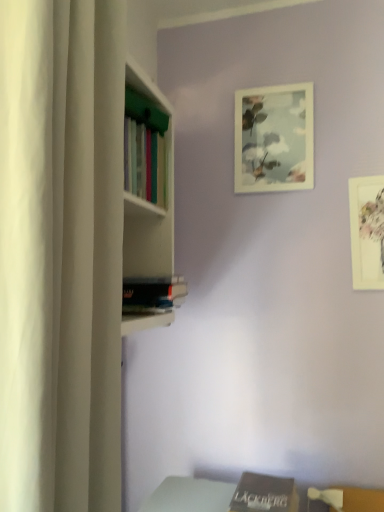
What do you see at coordinates (264, 494) in the screenshot? I see `brown matte book at lower center, positioned as the second book in left-to-right order` at bounding box center [264, 494].

Locate an element on the screen. Image resolution: width=384 pixels, height=512 pixels. hardcover book at center, the 2th book from the bottom is located at coordinates (153, 294).

Find the location of a particular element. Image resolution: width=384 pixels, height=512 pixels. white matte picture frame at upper right, the 1th picture frame when ordered from right to left is located at coordinates (367, 232).

From a real-world perspective, is white matte picture frame at upper right, marked as the second picture frame in a left-to-right arrangement, under white matte curtain at left?

No.

Is white matte curtain at left surrounded by white matte picture frame at upper right, the 2th picture frame when ordered from top to bottom?

Actually, white matte curtain at left is outside white matte picture frame at upper right, the 2th picture frame when ordered from top to bottom.

Does point (370, 217) appear closer or farther from the camera than point (2, 495)?

Clearly, point (370, 217) is more distant from the camera than point (2, 495).

From a real-world perspective, which object stands above the other?

From a 3D spatial view, matte white picture frame at upper center, the 1th picture frame positioned from the left, is above.

Are matte white picture frame at upper center, marked as the 2th picture frame in a bottom-to-top arrangement, and white matte picture frame at upper right, the 1th picture frame in the front-to-back sequence, far apart?

No, there isn't a large distance between matte white picture frame at upper center, marked as the 2th picture frame in a bottom-to-top arrangement, and white matte picture frame at upper right, the 1th picture frame in the front-to-back sequence.

Considering the relative positions of matte white picture frame at upper center, positioned as the second picture frame in right-to-left order, and white matte picture frame at upper right, the 2th picture frame when ordered from top to bottom, in the image provided, is matte white picture frame at upper center, positioned as the second picture frame in right-to-left order, to the right of white matte picture frame at upper right, the 2th picture frame when ordered from top to bottom, from the viewer's perspective?

Incorrect, matte white picture frame at upper center, positioned as the second picture frame in right-to-left order, is not on the right side of white matte picture frame at upper right, the 2th picture frame when ordered from top to bottom.

How many degrees apart are the facing directions of matte white picture frame at upper center, positioned as the second picture frame in right-to-left order, and white matte picture frame at upper right, the 1th picture frame when ordered from right to left?

The facing directions of matte white picture frame at upper center, positioned as the second picture frame in right-to-left order, and white matte picture frame at upper right, the 1th picture frame when ordered from right to left, are 0.00377 degrees apart.

From a real-world perspective, is white matte picture frame at upper right, marked as the second picture frame in a left-to-right arrangement, beneath brown matte book at lower center, positioned as the second book in left-to-right order?

No.

Is white matte picture frame at upper right, the 2th picture frame when ordered from top to bottom, not within brown matte book at lower center, the 1th book from the right?

Yes, white matte picture frame at upper right, the 2th picture frame when ordered from top to bottom, is not within brown matte book at lower center, the 1th book from the right.

Is white matte picture frame at upper right, the 1th picture frame when ordered from right to left, thinner than brown matte book at lower center, positioned as the second book in left-to-right order?

Correct, the width of white matte picture frame at upper right, the 1th picture frame when ordered from right to left, is less than that of brown matte book at lower center, positioned as the second book in left-to-right order.

Is there a large distance between white matte picture frame at upper right, the 1th picture frame when ordered from right to left, and brown matte book at lower center, the first book when ordered from bottom to top?

That's not correct — white matte picture frame at upper right, the 1th picture frame when ordered from right to left, is a little close to brown matte book at lower center, the first book when ordered from bottom to top.

Who is more distant, brown matte book at lower center, the first book when ordered from bottom to top, or hardcover book at center, the first book from the top?

Positioned behind is hardcover book at center, the first book from the top.

Which of these two, brown matte book at lower center, positioned as the second book in left-to-right order, or hardcover book at center, the 2th book from the bottom, is smaller?

brown matte book at lower center, positioned as the second book in left-to-right order.

Does brown matte book at lower center, which is the second book from top to bottom, have a greater height compared to hardcover book at center, the 2th book from the bottom?

No.

From a real-world perspective, is hardcover book at center, the 1th book from the left, located higher than white matte curtain at left?

No, from a real-world perspective, hardcover book at center, the 1th book from the left, is not over white matte curtain at left

Is hardcover book at center, the second book positioned from the right, oriented away from white matte curtain at left?

No.

Is hardcover book at center, the 1th book from the left, inside or outside of white matte curtain at left?

hardcover book at center, the 1th book from the left, is outside white matte curtain at left.

From the image's perspective, is hardcover book at center, the 1th book from the left, above or below white matte curtain at left?

Clearly, from the image's perspective, hardcover book at center, the 1th book from the left, is below white matte curtain at left.

How different are the orientations of brown matte book at lower center, positioned as the second book in left-to-right order, and white matte picture frame at upper right, the 1th picture frame when ordered from right to left, in degrees?

They differ by 0.254 degrees in their facing directions.

From a real-world perspective, relative to white matte picture frame at upper right, the 1th picture frame ordered from the bottom, is brown matte book at lower center, the 1th book from the right, vertically above or below?

Clearly, from a real-world perspective, brown matte book at lower center, the 1th book from the right, is below white matte picture frame at upper right, the 1th picture frame ordered from the bottom.

Is brown matte book at lower center, the 1th book from the right, surrounding white matte picture frame at upper right, the 1th picture frame ordered from the bottom?

No, white matte picture frame at upper right, the 1th picture frame ordered from the bottom, is located outside of brown matte book at lower center, the 1th book from the right.

Is white matte curtain at left at the right side of white matte picture frame at upper right, marked as the second picture frame in a left-to-right arrangement?

No.

From the image's perspective, which one is positioned lower, white matte curtain at left or white matte picture frame at upper right, marked as the second picture frame in a left-to-right arrangement?

white matte curtain at left.

From a real-world perspective, is white matte curtain at left beneath white matte picture frame at upper right, marked as the second picture frame in a left-to-right arrangement?

Yes.

Is white matte curtain at left bigger than white matte picture frame at upper right, which is counted as the second picture frame, starting from the back?

Indeed, white matte curtain at left has a larger size compared to white matte picture frame at upper right, which is counted as the second picture frame, starting from the back.

You are a GUI agent. You are given a task and a screenshot of the screen. Output one action in this format:
    pyautogui.click(x=<x>, y=<y>)
    Task: Click on the curtain below the white matte picture frame at upper right, the 1th picture frame in the front-to-back sequence (from the image's perspective)
    This screenshot has height=512, width=384.
    Given the screenshot: What is the action you would take?
    pyautogui.click(x=61, y=253)

You are a GUI agent. You are given a task and a screenshot of the screen. Output one action in this format:
    pyautogui.click(x=<x>, y=<y>)
    Task: Click on the picture frame that appears on the left of white matte picture frame at upper right, the 1th picture frame in the front-to-back sequence
    This screenshot has height=512, width=384.
    Given the screenshot: What is the action you would take?
    pyautogui.click(x=274, y=139)

Which object lies nearer to the anchor point hardcover book at center, the 2th book from the bottom, brown matte book at lower center, positioned as the second book in left-to-right order, or white matte picture frame at upper right, the 2th picture frame when ordered from top to bottom?

brown matte book at lower center, positioned as the second book in left-to-right order, lies closer to hardcover book at center, the 2th book from the bottom, than the other object.

Looking at the image, which one is located closer to white matte picture frame at upper right, the 1th picture frame in the front-to-back sequence, white matte curtain at left or hardcover book at center, the second book positioned from the right?

hardcover book at center, the second book positioned from the right, lies closer to white matte picture frame at upper right, the 1th picture frame in the front-to-back sequence, than the other object.

Estimate the real-world distances between objects in this image. Which object is closer to white matte picture frame at upper right, the 2th picture frame when ordered from top to bottom, matte white picture frame at upper center, marked as the 2th picture frame in a bottom-to-top arrangement, or white matte curtain at left?

Among the two, matte white picture frame at upper center, marked as the 2th picture frame in a bottom-to-top arrangement, is located nearer to white matte picture frame at upper right, the 2th picture frame when ordered from top to bottom.

Consider the image. Which object lies nearer to the anchor point white matte curtain at left, hardcover book at center, the 2th book from the bottom, or white matte picture frame at upper right, the 1th picture frame when ordered from right to left?

hardcover book at center, the 2th book from the bottom, lies closer to white matte curtain at left than the other object.

Based on their spatial positions, is matte white picture frame at upper center, marked as the 2th picture frame in a bottom-to-top arrangement, or hardcover book at center, the first book from the top, further from white matte curtain at left?

matte white picture frame at upper center, marked as the 2th picture frame in a bottom-to-top arrangement, lies further to white matte curtain at left than the other object.

Based on their spatial positions, is matte white picture frame at upper center, marked as the 2th picture frame in a bottom-to-top arrangement, or white matte picture frame at upper right, the 1th picture frame when ordered from right to left, closer to hardcover book at center, the second book positioned from the right?

The object closer to hardcover book at center, the second book positioned from the right, is matte white picture frame at upper center, marked as the 2th picture frame in a bottom-to-top arrangement.

Based on their spatial positions, is brown matte book at lower center, the 1th book from the right, or hardcover book at center, the second book positioned from the right, further from white matte picture frame at upper right, marked as the second picture frame in a left-to-right arrangement?

brown matte book at lower center, the 1th book from the right, lies further to white matte picture frame at upper right, marked as the second picture frame in a left-to-right arrangement, than the other object.

When comparing their distances from white matte curtain at left, does white matte picture frame at upper right, which is counted as the second picture frame, starting from the back, or brown matte book at lower center, the first book when ordered from bottom to top, seem further?

Among the two, white matte picture frame at upper right, which is counted as the second picture frame, starting from the back, is located further to white matte curtain at left.

You are a GUI agent. You are given a task and a screenshot of the screen. Output one action in this format:
    pyautogui.click(x=<x>, y=<y>)
    Task: Click on the curtain between matte white picture frame at upper center, the 1th picture frame positioned from the left, and brown matte book at lower center, the first book when ordered from bottom to top, from top to bottom
    This screenshot has height=512, width=384.
    Given the screenshot: What is the action you would take?
    pyautogui.click(x=61, y=253)

Locate an element on the screen. picture frame between white matte curtain at left and matte white picture frame at upper center, arranged as the second picture frame when viewed from the front, along the z-axis is located at coordinates (367, 232).

The width and height of the screenshot is (384, 512). I want to click on picture frame between hardcover book at center, the 2th book from the bottom, and white matte picture frame at upper right, which is counted as the second picture frame, starting from the back, so click(274, 139).

Image resolution: width=384 pixels, height=512 pixels. I want to click on book between matte white picture frame at upper center, arranged as the 1th picture frame when viewed from the top, and brown matte book at lower center, the first book when ordered from bottom to top, in the up-down direction, so click(153, 294).